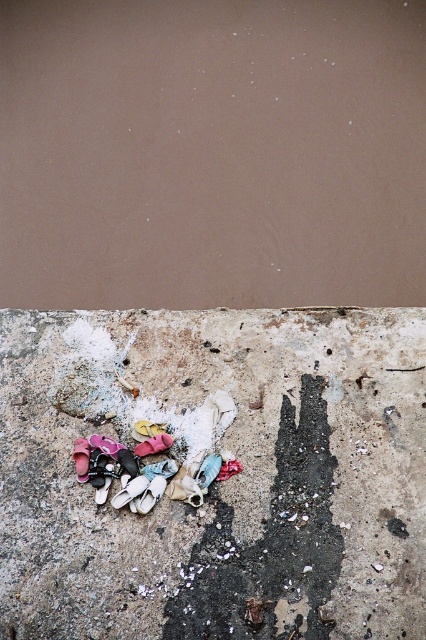
Does dirty concrete shoes at bottom center have a smaller size compared to pink fabric shoe at lower center?

Actually, dirty concrete shoes at bottom center might be larger than pink fabric shoe at lower center.

Does dirty concrete shoes at bottom center have a lesser width compared to pink fabric shoe at lower center?

In fact, dirty concrete shoes at bottom center might be wider than pink fabric shoe at lower center.

Is point (324, 376) more distant than point (155, 435)?

That is True.

Find the location of `dirty concrete shoes at bottom center`. dirty concrete shoes at bottom center is located at coordinates (216, 481).

Between white fabric shoe at lower left and pink fabric shoe at lower center, which one appears on the right side from the viewer's perspective?

From the viewer's perspective, pink fabric shoe at lower center appears more on the right side.

Is point (129, 499) positioned after point (155, 442)?

No, (129, 499) is in front of (155, 442).

The width and height of the screenshot is (426, 640). I want to click on white fabric shoe at lower left, so click(129, 492).

Consider the image. Between dirty concrete shoes at bottom center and white fabric shoe at lower left, which one appears on the right side from the viewer's perspective?

Positioned to the right is dirty concrete shoes at bottom center.

Is dirty concrete shoes at bottom center bigger than white fabric shoe at lower left?

Correct, dirty concrete shoes at bottom center is larger in size than white fabric shoe at lower left.

Is point (103, 577) farther from viewer compared to point (140, 477)?

No, (103, 577) is in front of (140, 477).

Where is `dirty concrete shoes at bottom center`? Image resolution: width=426 pixels, height=640 pixels. dirty concrete shoes at bottom center is located at coordinates (216, 481).